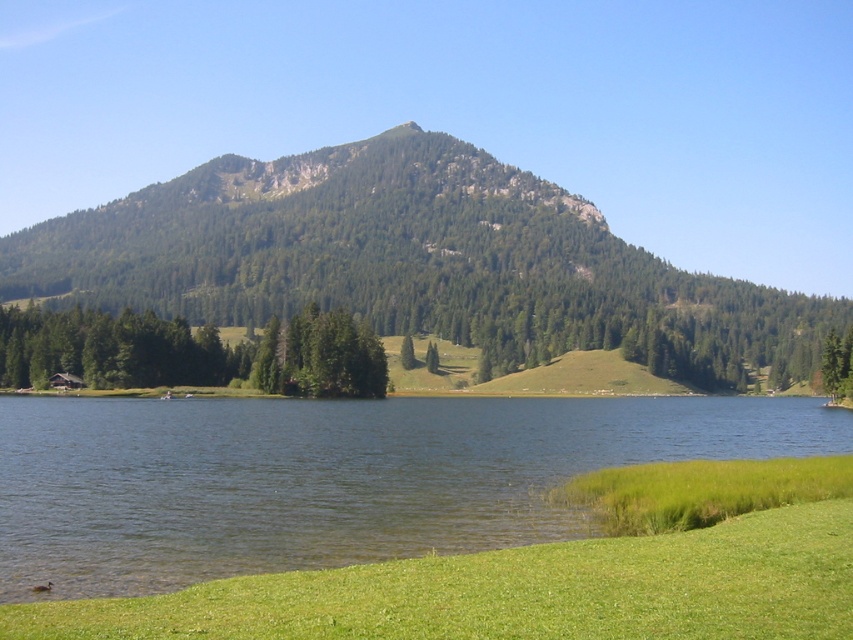
You are standing at the edge of the green grassy shore at lower right and want to take a photo of the green forested mountain at center. Which object in the scene takes up more space in the photo?

The green forested mountain at center occupies more space in the photo than the green grassy shore at lower right because the green forested mountain at center takes up more space than the green grassy shore at lower right.

You are standing on the green grassy shore at lower right and want to reach the green forested mountain at center. Which direction should you walk to get there?

Answer: To reach the green forested mountain at center from the green grassy shore at lower right, you should walk towards the center of the image, as the green grassy shore at lower right is positioned under the green forested mountain at center.

You are standing at the edge of the green grassy shore at lower right and want to walk towards the green forested mountain at center. Is the mountain behind or in front of you?

The green grassy shore at lower right is in front of the green forested mountain at center, so the mountain is behind you.